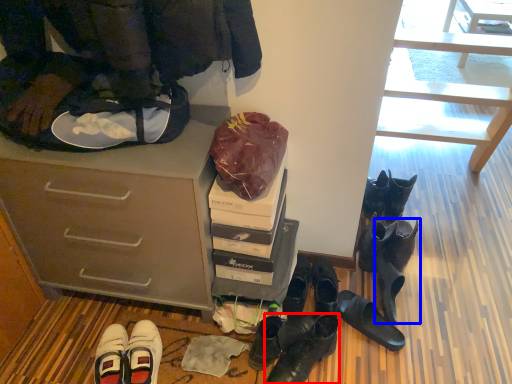
Question: Which of the following is the closest to the observer, footwear (highlighted by a red box) or footwear (highlighted by a blue box)?

Choices:
 (A) footwear
 (B) footwear

Answer: (A)